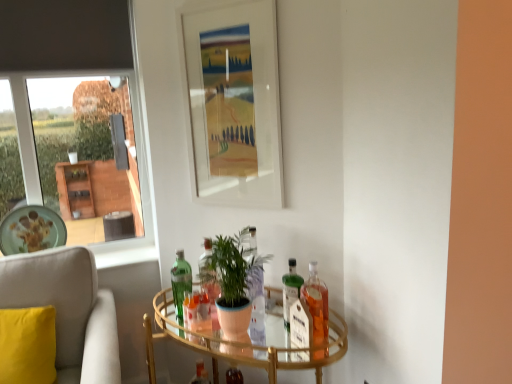
Question: From the image's perspective, is clear glass table at center positioned above or below translucent glass bottle at center, which is the first bottle from back to front?

Choices:
 (A) below
 (B) above

Answer: (B)

Question: Is point (280, 350) positioned closer to the camera than point (202, 367)?

Choices:
 (A) closer
 (B) farther

Answer: (A)

Question: Which of these objects is positioned farthest from the soft beige fabric chair at left?

Choices:
 (A) green matte plant at center
 (B) translucent glass bottle at right, the 1th bottle in the right-to-left sequence
 (C) clear glass table at center
 (D) translucent glass bottle at center, the third bottle in the right-to-left sequence
 (E) matte ceramic plate at left

Answer: (B)

Question: Considering the real-world distances, which object is closest to the translucent glass bottle at center, the third bottle in the right-to-left sequence?

Choices:
 (A) soft beige fabric chair at left
 (B) white matte picture frame at upper center
 (C) green glass bottle at center, placed as the third bottle when sorted from left to right
 (D) translucent glass bottle at right, which is the fourth bottle from left to right
 (E) clear glass table at center

Answer: (E)